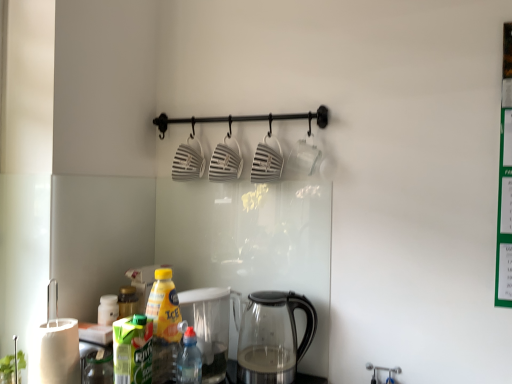
Question: From the image's perspective, is transparent glass kettle at lower center on yellow plastic bottle at lower left, placed as the 2th bottle when sorted from right to left?

Choices:
 (A) yes
 (B) no

Answer: (B)

Question: Is transparent glass kettle at lower center directly adjacent to yellow plastic bottle at lower left, arranged as the first bottle when viewed from the left?

Choices:
 (A) yes
 (B) no

Answer: (B)

Question: Is transparent glass kettle at lower center located outside yellow plastic bottle at lower left, arranged as the first bottle when viewed from the left?

Choices:
 (A) yes
 (B) no

Answer: (A)

Question: Is yellow plastic bottle at lower left, placed as the 2th bottle when sorted from right to left, located within transparent glass kettle at lower center?

Choices:
 (A) no
 (B) yes

Answer: (A)

Question: From a real-world perspective, is transparent glass kettle at lower center located beneath yellow plastic bottle at lower left, placed as the 2th bottle when sorted from right to left?

Choices:
 (A) no
 (B) yes

Answer: (B)

Question: Considering the relative sizes of transparent glass kettle at lower center and yellow plastic bottle at lower left, placed as the 2th bottle when sorted from right to left, in the image provided, is transparent glass kettle at lower center wider than yellow plastic bottle at lower left, placed as the 2th bottle when sorted from right to left,?

Choices:
 (A) yes
 (B) no

Answer: (A)

Question: Does yellow plastic bottle at lower left, placed as the 2th bottle when sorted from right to left, appear on the right side of transparent glass kettle at lower center?

Choices:
 (A) no
 (B) yes

Answer: (A)

Question: Is transparent glass kettle at lower center located within yellow plastic bottle at lower left, arranged as the first bottle when viewed from the left?

Choices:
 (A) yes
 (B) no

Answer: (B)

Question: Can you see yellow plastic bottle at lower left, arranged as the first bottle when viewed from the left, touching transparent glass kettle at lower center?

Choices:
 (A) no
 (B) yes

Answer: (A)

Question: Is yellow plastic bottle at lower left, arranged as the first bottle when viewed from the left, looking in the opposite direction of transparent glass kettle at lower center?

Choices:
 (A) no
 (B) yes

Answer: (A)

Question: Is yellow plastic bottle at lower left, arranged as the first bottle when viewed from the left, positioned before transparent glass kettle at lower center?

Choices:
 (A) no
 (B) yes

Answer: (B)

Question: Is yellow plastic bottle at lower left, arranged as the first bottle when viewed from the left, at the left side of transparent glass kettle at lower center?

Choices:
 (A) no
 (B) yes

Answer: (B)

Question: Is yellow plastic bottle at lower left, arranged as the first bottle when viewed from the left, surrounding translucent plastic bottle at lower center, arranged as the 2th bottle when viewed from the left?

Choices:
 (A) no
 (B) yes

Answer: (A)